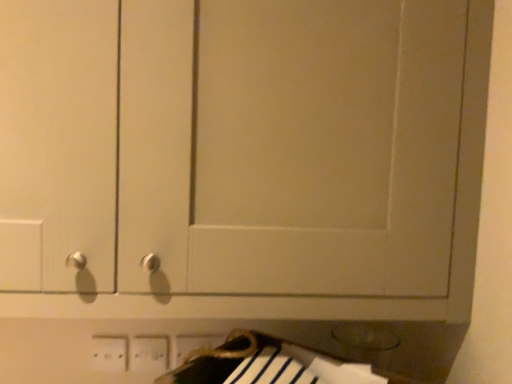
Question: Which direction should I rotate to look at white plastic electric outlet at lower center, acting as the 2th electric outlet starting from the right?

Choices:
 (A) right
 (B) left

Answer: (B)

Question: Considering the relative sizes of white plastic electric outlet at lower center, which appears as the first electric outlet when viewed from the right, and white plastic electric outlet at lower center, acting as the 2th electric outlet starting from the left, in the image provided, is white plastic electric outlet at lower center, which appears as the first electric outlet when viewed from the right, wider than white plastic electric outlet at lower center, acting as the 2th electric outlet starting from the left,?

Choices:
 (A) no
 (B) yes

Answer: (A)

Question: From a real-world perspective, is white plastic electric outlet at lower center, which appears as the first electric outlet when viewed from the right, physically below white plastic electric outlet at lower center, acting as the 2th electric outlet starting from the right?

Choices:
 (A) yes
 (B) no

Answer: (B)

Question: Is white plastic electric outlet at lower center, which ranks as the 3th electric outlet in left-to-right order, not near white plastic electric outlet at lower center, acting as the 2th electric outlet starting from the left?

Choices:
 (A) yes
 (B) no

Answer: (B)

Question: Considering the relative sizes of white plastic electric outlet at lower center, which ranks as the 3th electric outlet in left-to-right order, and white plastic electric outlet at lower center, acting as the 2th electric outlet starting from the left, in the image provided, is white plastic electric outlet at lower center, which ranks as the 3th electric outlet in left-to-right order, shorter than white plastic electric outlet at lower center, acting as the 2th electric outlet starting from the left,?

Choices:
 (A) no
 (B) yes

Answer: (B)

Question: Is the surface of white plastic electric outlet at lower center, which ranks as the 3th electric outlet in left-to-right order, in direct contact with white plastic electric outlet at lower center, acting as the 2th electric outlet starting from the left?

Choices:
 (A) no
 (B) yes

Answer: (B)

Question: From a real-world perspective, is white plastic electric outlet at lower center, which ranks as the 3th electric outlet in left-to-right order, on top of white plastic electric outlet at lower center, acting as the 2th electric outlet starting from the right?

Choices:
 (A) yes
 (B) no

Answer: (A)

Question: Is white plastic electric outlet at lower center, which is counted as the 1th electric outlet, starting from the left, closer to the viewer compared to white plastic electric outlet at lower center, which appears as the first electric outlet when viewed from the right?

Choices:
 (A) no
 (B) yes

Answer: (B)

Question: Is white plastic electric outlet at lower center, which is counted as the 1th electric outlet, starting from the left, facing towards white plastic electric outlet at lower center, which ranks as the 3th electric outlet in left-to-right order?

Choices:
 (A) no
 (B) yes

Answer: (A)

Question: Is there a large distance between white plastic electric outlet at lower center, arranged as the 3th electric outlet when viewed from the right, and white plastic electric outlet at lower center, which ranks as the 3th electric outlet in left-to-right order?

Choices:
 (A) yes
 (B) no

Answer: (B)

Question: Does white plastic electric outlet at lower center, which is counted as the 1th electric outlet, starting from the left, come behind white plastic electric outlet at lower center, which appears as the first electric outlet when viewed from the right?

Choices:
 (A) no
 (B) yes

Answer: (A)

Question: Is white plastic electric outlet at lower center, arranged as the 3th electric outlet when viewed from the right, not inside white plastic electric outlet at lower center, which ranks as the 3th electric outlet in left-to-right order?

Choices:
 (A) yes
 (B) no

Answer: (A)

Question: Could white plastic electric outlet at lower center, which ranks as the 3th electric outlet in left-to-right order, be considered to be inside white plastic electric outlet at lower center, arranged as the 3th electric outlet when viewed from the right?

Choices:
 (A) yes
 (B) no

Answer: (B)

Question: Does white plastic electric outlet at lower center, which ranks as the 3th electric outlet in left-to-right order, turn towards white plastic electric outlet at lower center, arranged as the 3th electric outlet when viewed from the right?

Choices:
 (A) no
 (B) yes

Answer: (A)